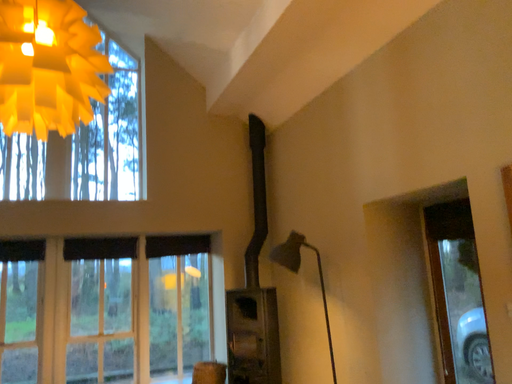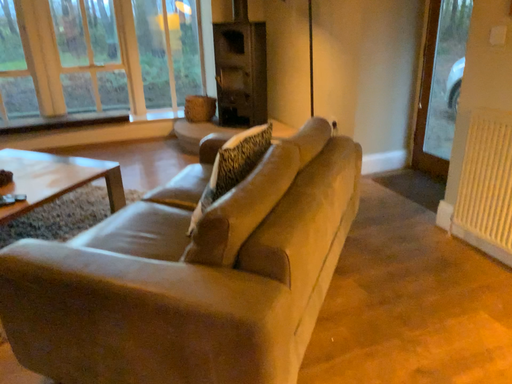
Question: How did the camera likely rotate when shooting the video?

Choices:
 (A) rotated upward
 (B) rotated downward

Answer: (B)